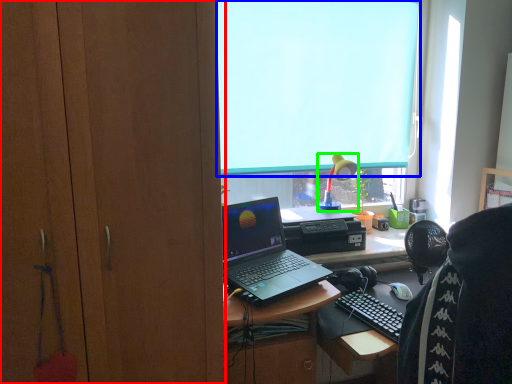
Question: Estimate the real-world distances between objects in this image. Which object is farther from cabinetry (highlighted by a red box), window screen (highlighted by a blue box) or lamp (highlighted by a green box)?

Choices:
 (A) window screen
 (B) lamp

Answer: (B)